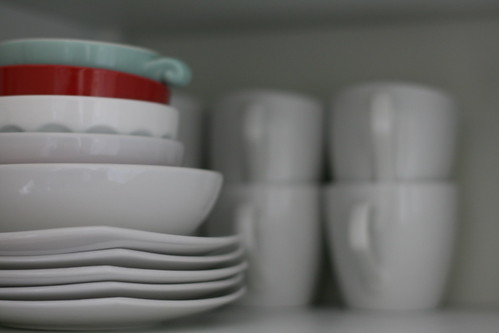
Identify the location of plate. (135, 307), (121, 289), (137, 276), (119, 257), (93, 239).